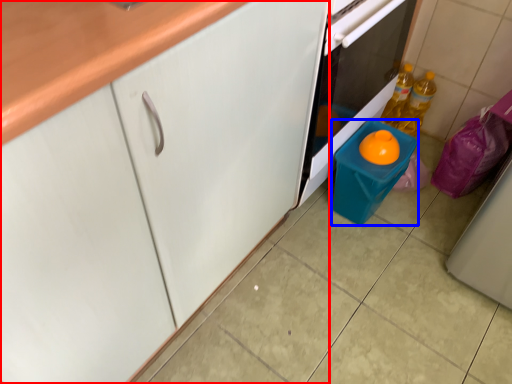
Question: Among these objects, which one is farthest to the camera, cabinetry (highlighted by a red box) or appliance (highlighted by a blue box)?

Choices:
 (A) cabinetry
 (B) appliance

Answer: (B)